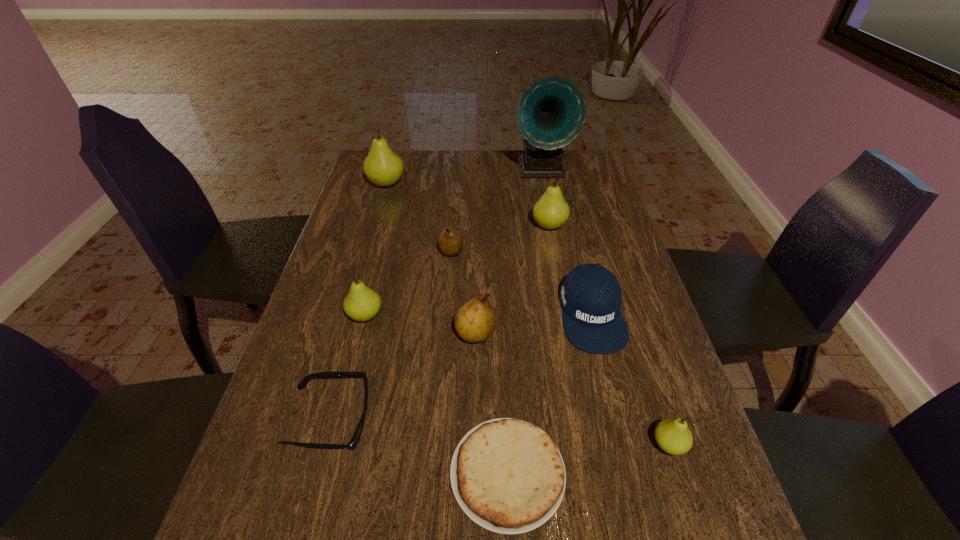
Where is `vacant region located 0.230m on the front-facing side of the baseball cap`? This screenshot has width=960, height=540. vacant region located 0.230m on the front-facing side of the baseball cap is located at coordinates (627, 456).

You are a GUI agent. You are given a task and a screenshot of the screen. Output one action in this format:
    pyautogui.click(x=<x>, y=<y>)
    Task: Click on the vacant space located 0.100m on the left of the smaller brown pear
    The height and width of the screenshot is (540, 960).
    Given the screenshot: What is the action you would take?
    pyautogui.click(x=404, y=252)

Locate an element on the screen. free spot located 0.150m on the back of the nearest green pear is located at coordinates (643, 366).

This screenshot has width=960, height=540. In order to click on free region located on the front-facing side of the second shortest object in this screenshot , I will do `click(540, 420)`.

Locate an element on the screen. vacant space located 0.140m on the left of the beige tortilla is located at coordinates (373, 474).

Locate an element on the screen. This screenshot has width=960, height=540. phonograph_record at the far edge is located at coordinates (551, 112).

Find the location of `pear located at the far edge`. pear located at the far edge is located at coordinates (383, 167).

You are a GUI agent. You are given a task and a screenshot of the screen. Output one action in this format:
    pyautogui.click(x=<x>, y=<y>)
    Task: Click on the sunglasses positioned at the left edge
    This screenshot has height=540, width=960.
    Given the screenshot: What is the action you would take?
    pyautogui.click(x=352, y=444)

You are a GUI agent. You are given a task and a screenshot of the screen. Output one action in this format:
    pyautogui.click(x=<x>, y=<y>)
    Task: Click on the phonograph_record located in the right edge section of the desktop
    The height and width of the screenshot is (540, 960).
    Given the screenshot: What is the action you would take?
    pyautogui.click(x=551, y=112)

Identify the location of baseball cap that is at the right edge. (591, 296).